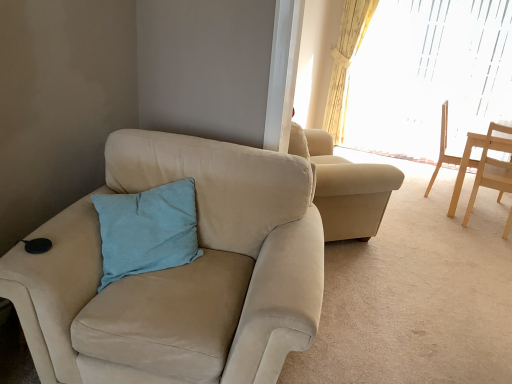
Locate an element on the screen. This screenshot has height=384, width=512. vacant space to the left of light wood chair at right, which appears as the 1th chair when viewed from the right is located at coordinates (438, 218).